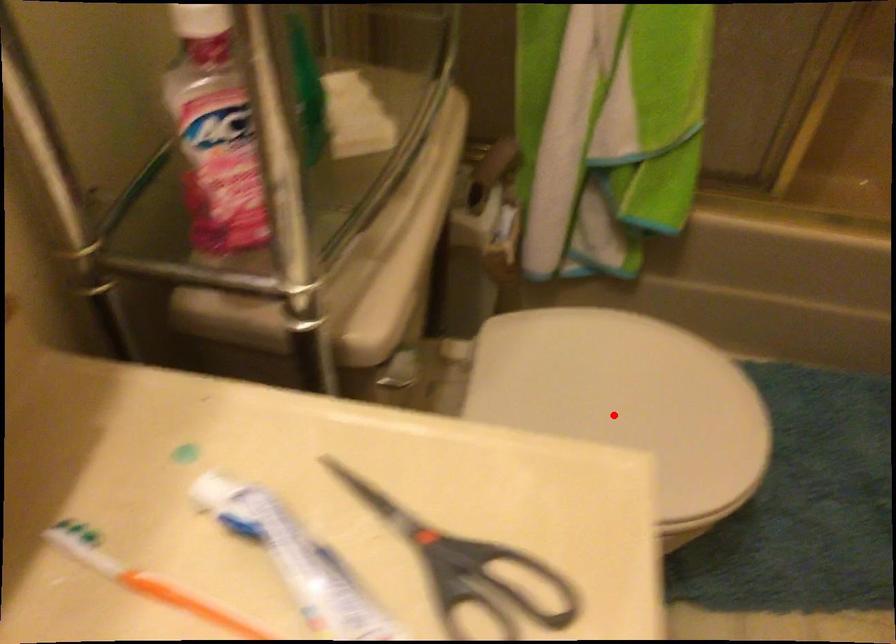
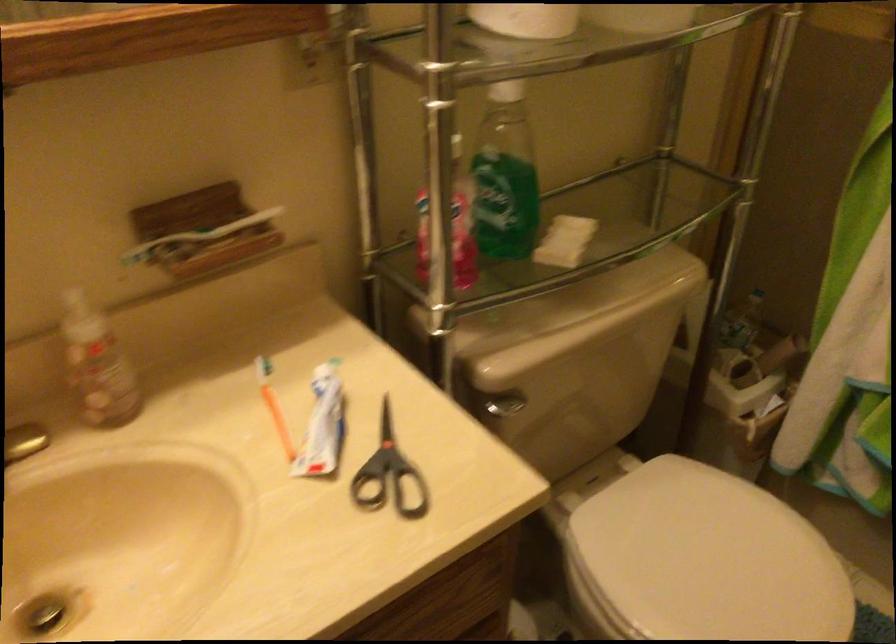
In the second image, find the point that corresponds to the highlighted location in the first image.

(702, 560)